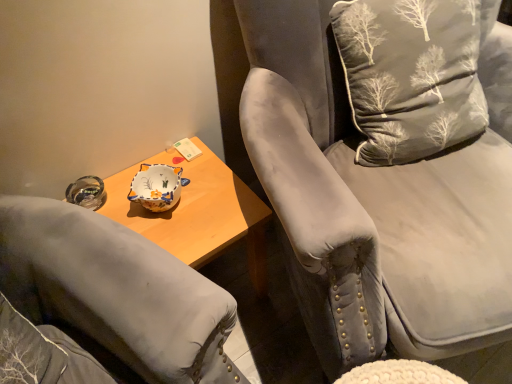
Question: Is velvet gray chair at upper right positioned before silvery fabric cushion at upper right?

Choices:
 (A) yes
 (B) no

Answer: (A)

Question: Does velvet gray chair at upper right turn towards silvery fabric cushion at upper right?

Choices:
 (A) yes
 (B) no

Answer: (A)

Question: Is velvet gray chair at upper right thinner than silvery fabric cushion at upper right?

Choices:
 (A) no
 (B) yes

Answer: (A)

Question: From the image's perspective, is velvet gray chair at upper right under silvery fabric cushion at upper right?

Choices:
 (A) no
 (B) yes

Answer: (B)

Question: Does velvet gray chair at upper right have a larger size compared to silvery fabric cushion at upper right?

Choices:
 (A) no
 (B) yes

Answer: (B)

Question: Is velvet gray chair at upper right looking in the opposite direction of silvery fabric cushion at upper right?

Choices:
 (A) yes
 (B) no

Answer: (A)

Question: Does silvery fabric cushion at upper right have a greater width compared to velvet gray chair at upper right?

Choices:
 (A) yes
 (B) no

Answer: (B)

Question: Is silvery fabric cushion at upper right far from velvet gray chair at upper right?

Choices:
 (A) no
 (B) yes

Answer: (A)

Question: From a real-world perspective, is silvery fabric cushion at upper right physically below velvet gray chair at upper right?

Choices:
 (A) no
 (B) yes

Answer: (A)

Question: From a real-world perspective, is silvery fabric cushion at upper right over velvet gray chair at upper right?

Choices:
 (A) no
 (B) yes

Answer: (B)

Question: Considering the relative sizes of silvery fabric cushion at upper right and velvet gray chair at upper right in the image provided, is silvery fabric cushion at upper right thinner than velvet gray chair at upper right?

Choices:
 (A) no
 (B) yes

Answer: (B)

Question: From the image's perspective, is silvery fabric cushion at upper right located above velvet gray chair at upper right?

Choices:
 (A) no
 (B) yes

Answer: (B)

Question: Looking at their shapes, would you say velvet gray chair at upper right is wider or thinner than silvery fabric cushion at upper right?

Choices:
 (A) wide
 (B) thin

Answer: (A)